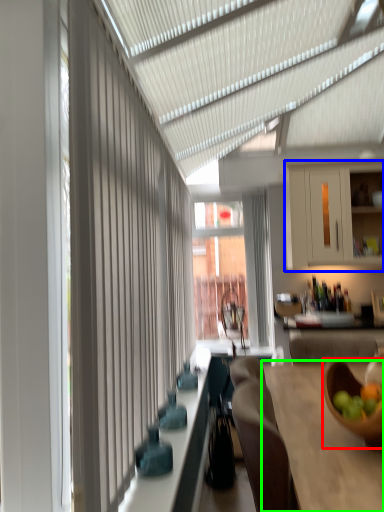
Question: Considering the real-world distances, which object is farthest from bowl (highlighted by a red box)? cabinetry (highlighted by a blue box) or table (highlighted by a green box)?

Choices:
 (A) cabinetry
 (B) table

Answer: (A)